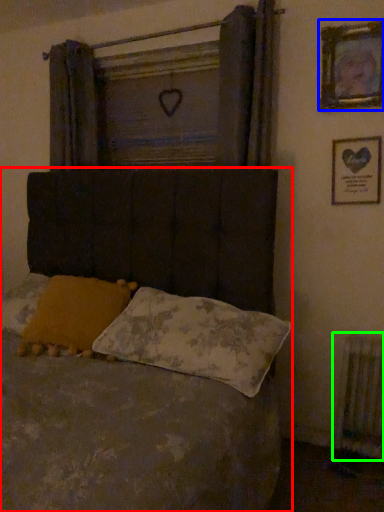
Question: Which is farther away from bed (highlighted by a red box)? picture frame (highlighted by a blue box) or radiator (highlighted by a green box)?

Choices:
 (A) picture frame
 (B) radiator

Answer: (B)